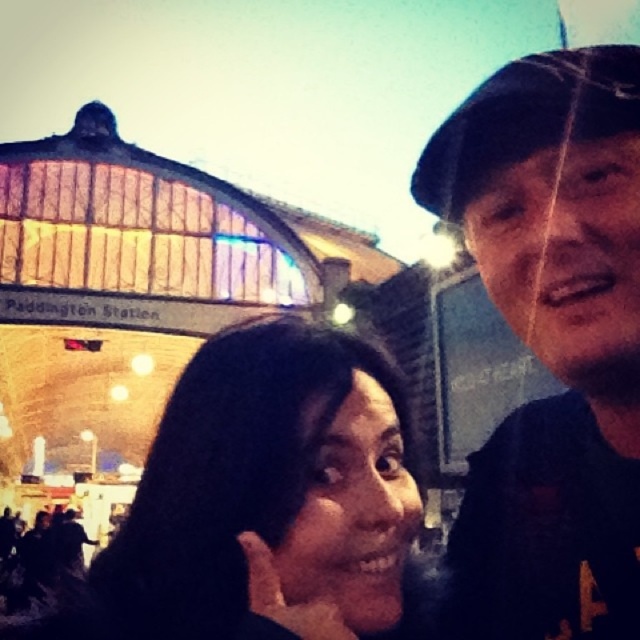
Which is below, black fabric cap at upper right or black hair at center?

Positioned lower is black hair at center.

Who is higher up, black fabric cap at upper right or black hair at center?

black fabric cap at upper right is higher up.

Locate an element on the screen. The image size is (640, 640). black fabric cap at upper right is located at coordinates (552, 342).